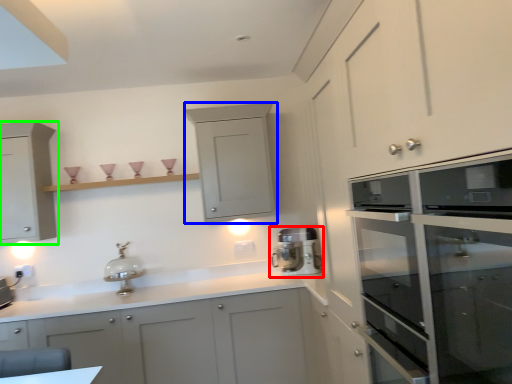
Question: Based on their relative distances, which object is nearer to home appliance (highlighted by a red box)? Choose from cabinetry (highlighted by a blue box) and cabinetry (highlighted by a green box).

Choices:
 (A) cabinetry
 (B) cabinetry

Answer: (A)